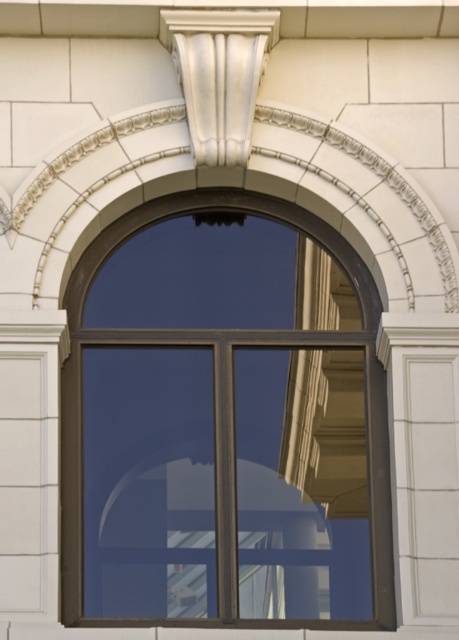
You are an architect designing a new building and want to ensure proper proportions between the glossy glass window at center and the white glossy column at upper center. Based on the image, which object should be placed higher to maintain visual balance?

The white glossy column at upper center should be placed higher since the glossy glass window at center is shorter than it, so elevating the column maintains visual balance.

You are an architect examining the window structure. There are two points marked on the window frame, namely point (x=247, y=285) and point (x=286, y=602). Which of these points is closer to you?

Point (x=247, y=285) is further to the viewer than point (x=286, y=602), so point (x=286, y=602) is closer to you.

You are an architect designing a new building and want to ensure proper structural support. Since the glossy glass window at center and the white glossy column at upper center are both part of the design, which object is above the other?

The white glossy column at upper center is above the glossy glass window at center because the glossy glass window at center is positioned under it.